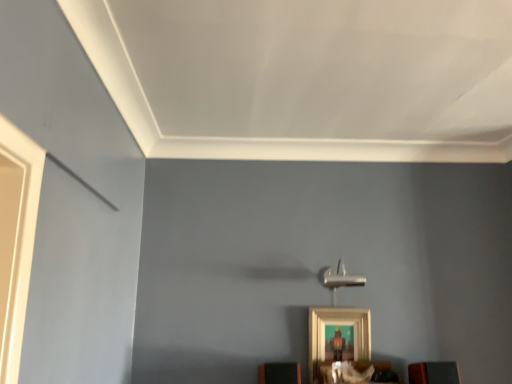
What do you see at coordinates (334, 333) in the screenshot? This screenshot has width=512, height=384. I see `gold metallic picture frame at lower center` at bounding box center [334, 333].

Image resolution: width=512 pixels, height=384 pixels. Find the location of `orange matte speaker at lower center, acting as the third furniture starting from the right`. orange matte speaker at lower center, acting as the third furniture starting from the right is located at coordinates (279, 373).

You are a GUI agent. You are given a task and a screenshot of the screen. Output one action in this format:
    pyautogui.click(x=<x>, y=<y>)
    Task: Click on the gold metallic picture frame at lower center
    
    Given the screenshot: What is the action you would take?
    pyautogui.click(x=334, y=333)

Which object is closer to the camera, matte black speaker at lower right, arranged as the first furniture when viewed from the right, or gold metallic picture frame at lower center?

matte black speaker at lower right, arranged as the first furniture when viewed from the right, is more forward.

From a real-world perspective, relative to gold metallic picture frame at lower center, is matte black speaker at lower right, which appears as the 3th furniture when viewed from the left, vertically above or below?

matte black speaker at lower right, which appears as the 3th furniture when viewed from the left, is below gold metallic picture frame at lower center.

Consider the image. How much distance is there between matte black speaker at lower right, arranged as the first furniture when viewed from the right, and gold metallic picture frame at lower center?

matte black speaker at lower right, arranged as the first furniture when viewed from the right, and gold metallic picture frame at lower center are 12.87 inches apart from each other.

From the image's perspective, is matte black speaker at lower right, arranged as the first furniture when viewed from the right, on top of gold metallic picture frame at lower center?

No, from the image's perspective, matte black speaker at lower right, arranged as the first furniture when viewed from the right, is not over gold metallic picture frame at lower center.

Does gold metallic picture frame at lower center turn towards matte black speaker at lower right, which appears as the 3th furniture when viewed from the left?

No, gold metallic picture frame at lower center is not facing towards matte black speaker at lower right, which appears as the 3th furniture when viewed from the left.

In the scene shown: Is gold metallic picture frame at lower center next to matte black speaker at lower right, which appears as the 3th furniture when viewed from the left, and touching it?

There is a gap between gold metallic picture frame at lower center and matte black speaker at lower right, which appears as the 3th furniture when viewed from the left.

Based on the photo, who is more distant, gold metallic picture frame at lower center or matte black speaker at lower right, arranged as the first furniture when viewed from the right?

Positioned behind is gold metallic picture frame at lower center.

From the image's perspective, is orange matte speaker at lower center, acting as the third furniture starting from the right, located above or below matte black speaker at lower right, arranged as the first furniture when viewed from the right?

From the image's perspective, orange matte speaker at lower center, acting as the third furniture starting from the right, appears above matte black speaker at lower right, arranged as the first furniture when viewed from the right.

Which of these two, orange matte speaker at lower center, acting as the 1th furniture starting from the left, or matte black speaker at lower right, which appears as the 3th furniture when viewed from the left, is bigger?

orange matte speaker at lower center, acting as the 1th furniture starting from the left, is bigger.

How different are the orientations of orange matte speaker at lower center, acting as the 1th furniture starting from the left, and matte black speaker at lower right, arranged as the first furniture when viewed from the right, in degrees?

The angular difference between orange matte speaker at lower center, acting as the 1th furniture starting from the left, and matte black speaker at lower right, arranged as the first furniture when viewed from the right, is 5.25 degrees.

Is matte black speaker at lower right, which appears as the 3th furniture when viewed from the left, inside orange matte speaker at lower center, acting as the third furniture starting from the right?

No.

Would you say gold metallic picture frame at lower center is to the left or to the right of orange matte speaker at lower center, acting as the 1th furniture starting from the left, in the picture?

Based on their positions, gold metallic picture frame at lower center is located to the right of orange matte speaker at lower center, acting as the 1th furniture starting from the left.

Is gold metallic picture frame at lower center not within orange matte speaker at lower center, acting as the 1th furniture starting from the left?

gold metallic picture frame at lower center lies outside orange matte speaker at lower center, acting as the 1th furniture starting from the left,'s area.

Where is `picture frame to the right of orange matte speaker at lower center, acting as the third furniture starting from the right`? This screenshot has height=384, width=512. picture frame to the right of orange matte speaker at lower center, acting as the third furniture starting from the right is located at coordinates (334, 333).

Between gold metallic picture frame at lower center and orange matte speaker at lower center, acting as the 1th furniture starting from the left, which one has larger size?

gold metallic picture frame at lower center.

Who is bigger, matte black speaker at lower right, arranged as the first furniture when viewed from the right, or orange matte speaker at lower center, acting as the third furniture starting from the right?

With larger size is orange matte speaker at lower center, acting as the third furniture starting from the right.

Looking at this image, from a real-world perspective, which is physically below, matte black speaker at lower right, arranged as the first furniture when viewed from the right, or orange matte speaker at lower center, acting as the third furniture starting from the right?

In real-world perspective, matte black speaker at lower right, arranged as the first furniture when viewed from the right, is lower.

In the image, is matte black speaker at lower right, which appears as the 3th furniture when viewed from the left, positioned in front of or behind orange matte speaker at lower center, acting as the 1th furniture starting from the left?

In the image, matte black speaker at lower right, which appears as the 3th furniture when viewed from the left, appears behind orange matte speaker at lower center, acting as the 1th furniture starting from the left.

Does point (432, 363) lie behind point (358, 374)?

No, (432, 363) is closer to viewer.

From a real-world perspective, does matte black speaker at lower right, arranged as the first furniture when viewed from the right, sit lower than wooden shelf at lower center, the second furniture from the left?

No, from a real-world perspective, matte black speaker at lower right, arranged as the first furniture when viewed from the right, is not beneath wooden shelf at lower center, the second furniture from the left.

Is wooden shelf at lower center, which ranks as the 2th furniture in right-to-left order, at the back of matte black speaker at lower right, which appears as the 3th furniture when viewed from the left?

matte black speaker at lower right, which appears as the 3th furniture when viewed from the left, is not turned away from wooden shelf at lower center, which ranks as the 2th furniture in right-to-left order.

Is gold metallic picture frame at lower center positioned beyond the bounds of wooden shelf at lower center, the second furniture from the left?

gold metallic picture frame at lower center lies outside wooden shelf at lower center, the second furniture from the left,'s area.

Could you tell me if gold metallic picture frame at lower center is facing wooden shelf at lower center, the second furniture from the left?

Yes, gold metallic picture frame at lower center faces towards wooden shelf at lower center, the second furniture from the left.

Is gold metallic picture frame at lower center next to wooden shelf at lower center, which ranks as the 2th furniture in right-to-left order?

No, gold metallic picture frame at lower center is not making contact with wooden shelf at lower center, which ranks as the 2th furniture in right-to-left order.

From the image's perspective, is gold metallic picture frame at lower center located above or below wooden shelf at lower center, the second furniture from the left?

Based on their image positions, gold metallic picture frame at lower center is located above wooden shelf at lower center, the second furniture from the left.

From a real-world perspective, starting from the gold metallic picture frame at lower center, which furniture is the 2nd one below it? Please provide its 2D coordinates.

[(433, 373)]

The width and height of the screenshot is (512, 384). I want to click on picture frame that appears above the matte black speaker at lower right, which appears as the 3th furniture when viewed from the left (from the image's perspective), so click(334, 333).

Based on their spatial positions, is wooden shelf at lower center, the second furniture from the left, or gold metallic picture frame at lower center further from matte black speaker at lower right, which appears as the 3th furniture when viewed from the left?

gold metallic picture frame at lower center lies further to matte black speaker at lower right, which appears as the 3th furniture when viewed from the left, than the other object.

Looking at the image, which one is located closer to wooden shelf at lower center, which ranks as the 2th furniture in right-to-left order, matte black speaker at lower right, which appears as the 3th furniture when viewed from the left, or gold metallic picture frame at lower center?

gold metallic picture frame at lower center lies closer to wooden shelf at lower center, which ranks as the 2th furniture in right-to-left order, than the other object.

Which object lies further to the anchor point matte black speaker at lower right, which appears as the 3th furniture when viewed from the left, wooden shelf at lower center, the second furniture from the left, or orange matte speaker at lower center, acting as the 1th furniture starting from the left?

orange matte speaker at lower center, acting as the 1th furniture starting from the left.

Which object lies nearer to the anchor point orange matte speaker at lower center, acting as the 1th furniture starting from the left, gold metallic picture frame at lower center or wooden shelf at lower center, which ranks as the 2th furniture in right-to-left order?

wooden shelf at lower center, which ranks as the 2th furniture in right-to-left order, is closer to orange matte speaker at lower center, acting as the 1th furniture starting from the left.

Based on the photo, considering their positions, is wooden shelf at lower center, which ranks as the 2th furniture in right-to-left order, positioned closer to orange matte speaker at lower center, acting as the 1th furniture starting from the left, than matte black speaker at lower right, arranged as the first furniture when viewed from the right?

wooden shelf at lower center, which ranks as the 2th furniture in right-to-left order.

Estimate the real-world distances between objects in this image. Which object is closer to wooden shelf at lower center, which ranks as the 2th furniture in right-to-left order, matte black speaker at lower right, which appears as the 3th furniture when viewed from the left, or orange matte speaker at lower center, acting as the third furniture starting from the right?

orange matte speaker at lower center, acting as the third furniture starting from the right, lies closer to wooden shelf at lower center, which ranks as the 2th furniture in right-to-left order, than the other object.

Based on their spatial positions, is orange matte speaker at lower center, acting as the 1th furniture starting from the left, or matte black speaker at lower right, arranged as the first furniture when viewed from the right, further from gold metallic picture frame at lower center?

Based on the image, matte black speaker at lower right, arranged as the first furniture when viewed from the right, appears to be further to gold metallic picture frame at lower center.

From the image, which object appears to be nearer to gold metallic picture frame at lower center, wooden shelf at lower center, the second furniture from the left, or orange matte speaker at lower center, acting as the third furniture starting from the right?

Among the two, wooden shelf at lower center, the second furniture from the left, is located nearer to gold metallic picture frame at lower center.

Find the location of `picture frame located between orange matte speaker at lower center, acting as the 1th furniture starting from the left, and wooden shelf at lower center, the second furniture from the left, in the left-right direction`. picture frame located between orange matte speaker at lower center, acting as the 1th furniture starting from the left, and wooden shelf at lower center, the second furniture from the left, in the left-right direction is located at coordinates (334, 333).

You are a GUI agent. You are given a task and a screenshot of the screen. Output one action in this format:
    pyautogui.click(x=<x>, y=<y>)
    Task: Click on the picture frame situated between orange matte speaker at lower center, acting as the third furniture starting from the right, and matte black speaker at lower right, arranged as the first furniture when viewed from the right, from left to right
    The height and width of the screenshot is (384, 512).
    Given the screenshot: What is the action you would take?
    pyautogui.click(x=334, y=333)

Where is `furniture located between gold metallic picture frame at lower center and matte black speaker at lower right, which appears as the 3th furniture when viewed from the left, in the left-right direction`? furniture located between gold metallic picture frame at lower center and matte black speaker at lower right, which appears as the 3th furniture when viewed from the left, in the left-right direction is located at coordinates (367, 370).

The image size is (512, 384). Identify the location of furniture located between orange matte speaker at lower center, acting as the 1th furniture starting from the left, and matte black speaker at lower right, arranged as the first furniture when viewed from the right, in the left-right direction. (367, 370).